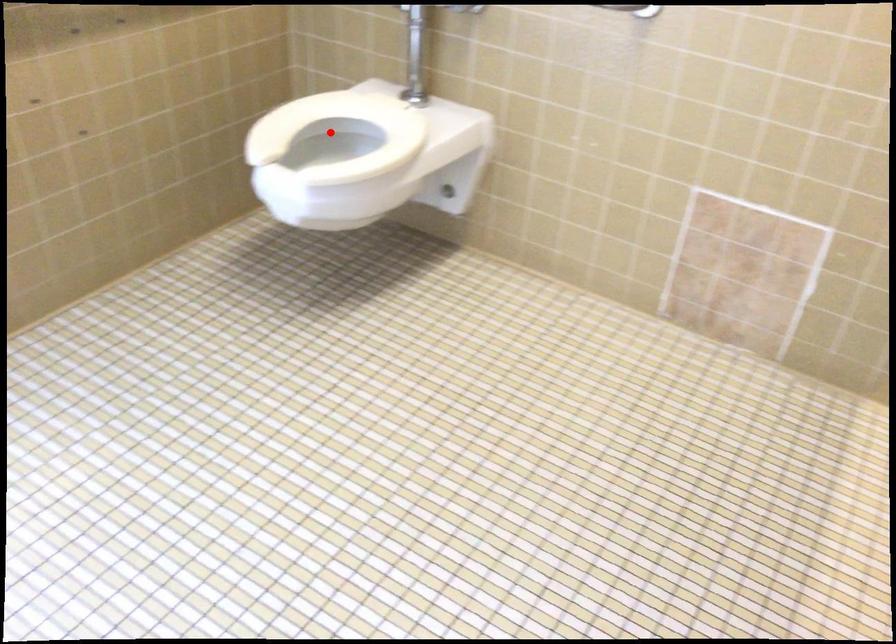
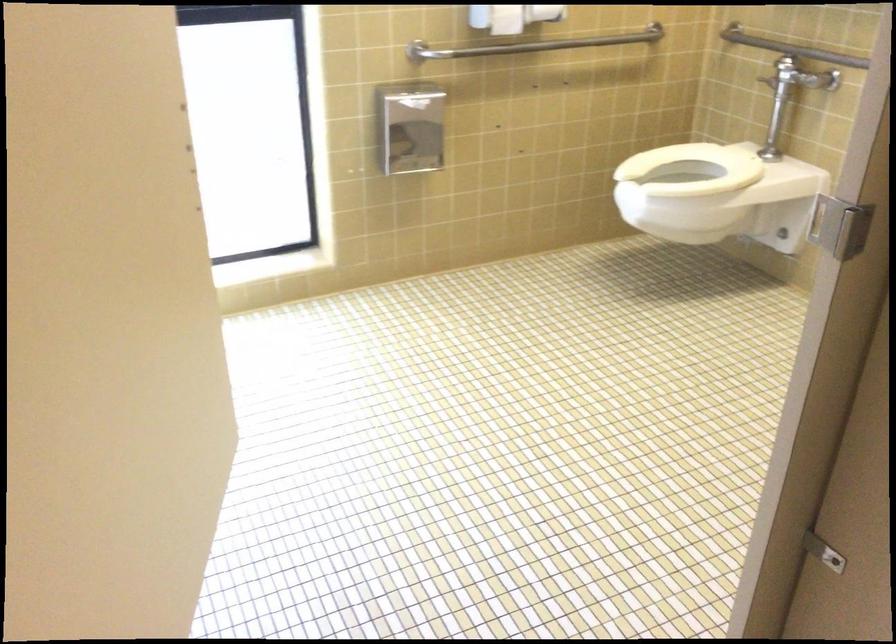
Question: I am providing you with two images of the same scene from different viewpoints. A red point is shown in image1. For the corresponding object point in image2, is it positioned nearer or farther from the camera?

Choices:
 (A) Nearer
 (B) Farther

Answer: (B)